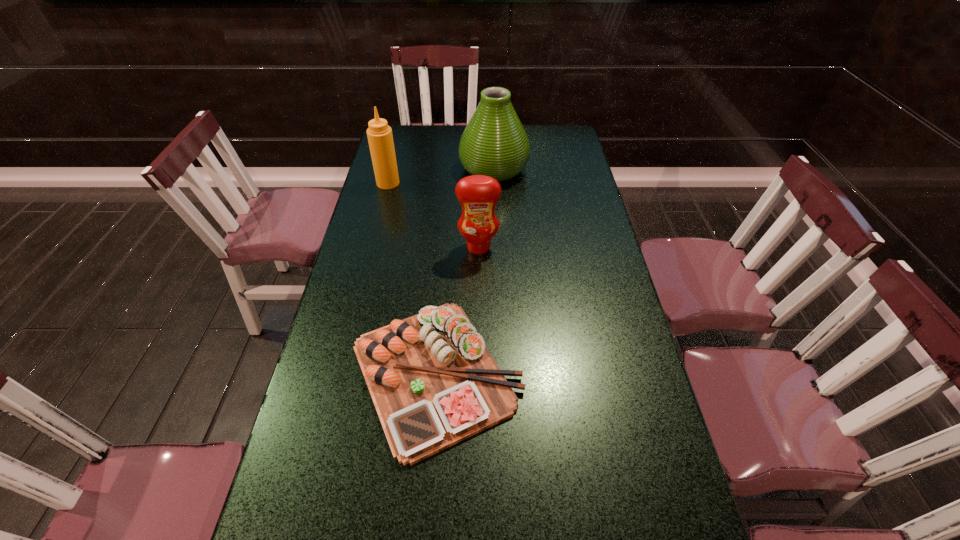
Where is `free space between the farther condiment and the vase`? This screenshot has width=960, height=540. free space between the farther condiment and the vase is located at coordinates (441, 176).

Identify the location of object that stands as the third closest to the vase. This screenshot has width=960, height=540. (433, 382).

Choose which object is the third nearest neighbor to the left condiment. Please provide its 2D coordinates. Your answer should be formatted as a tuple, i.e. [(x, y)], where the tuple contains the x and y coordinates of a point satisfying the conditions above.

[(433, 382)]

Find the location of a particular element. Image resolution: width=960 pixels, height=540 pixels. vacant point that satisfies the following two spatial constraints: 1. on the back side of the farther condiment; 2. on the left side of the vase is located at coordinates (392, 169).

Where is `vacant position in the image that satisfies the following two spatial constraints: 1. on the back side of the vase; 2. on the left side of the farther condiment`? This screenshot has height=540, width=960. vacant position in the image that satisfies the following two spatial constraints: 1. on the back side of the vase; 2. on the left side of the farther condiment is located at coordinates (392, 169).

Find the location of a particular element. free space that satisfies the following two spatial constraints: 1. on the back side of the farther condiment; 2. on the right side of the vase is located at coordinates (392, 169).